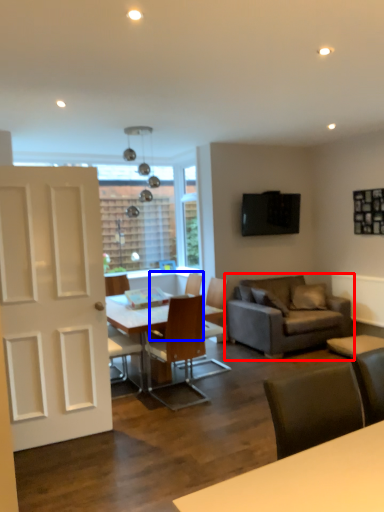
Question: Which point is closer to the camera, studio couch (highlighted by a red box) or chair (highlighted by a blue box)?

Choices:
 (A) studio couch
 (B) chair

Answer: (B)